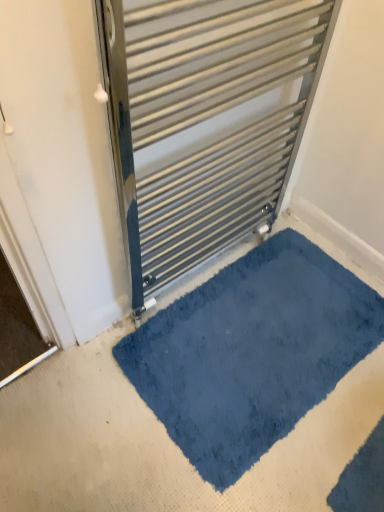
Find the location of a particular element. This screenshot has height=512, width=384. vacant region below metallic silver radiator at center (from a real-world perspective) is located at coordinates (199, 272).